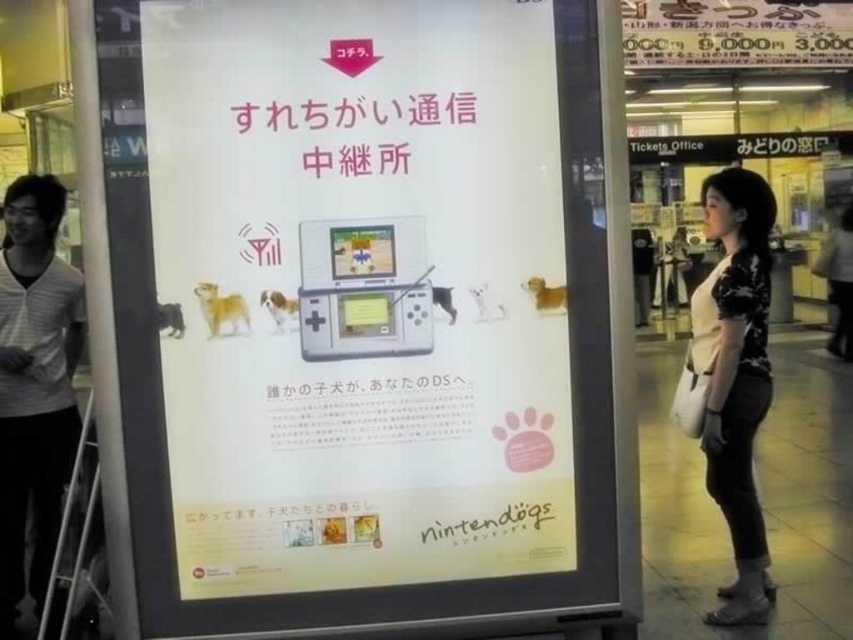
Question: Among these objects, which one is farthest from the camera?

Choices:
 (A) white paper poster at center
 (B) gray striped shirt at left
 (C) black floral shirt at center

Answer: (C)

Question: Is gray striped shirt at left positioned behind black floral shirt at center?

Choices:
 (A) no
 (B) yes

Answer: (A)

Question: Estimate the real-world distances between objects in this image. Which object is farther from the black floral shirt at center?

Choices:
 (A) white paper poster at center
 (B) gray striped shirt at left

Answer: (B)

Question: Is white paper poster at center above gray striped shirt at left?

Choices:
 (A) yes
 (B) no

Answer: (A)

Question: Which point is farther from the camera taking this photo?

Choices:
 (A) (729, 486)
 (B) (39, 595)
 (C) (460, 282)

Answer: (B)

Question: Is white paper poster at center to the right of gray striped shirt at left from the viewer's perspective?

Choices:
 (A) no
 (B) yes

Answer: (B)